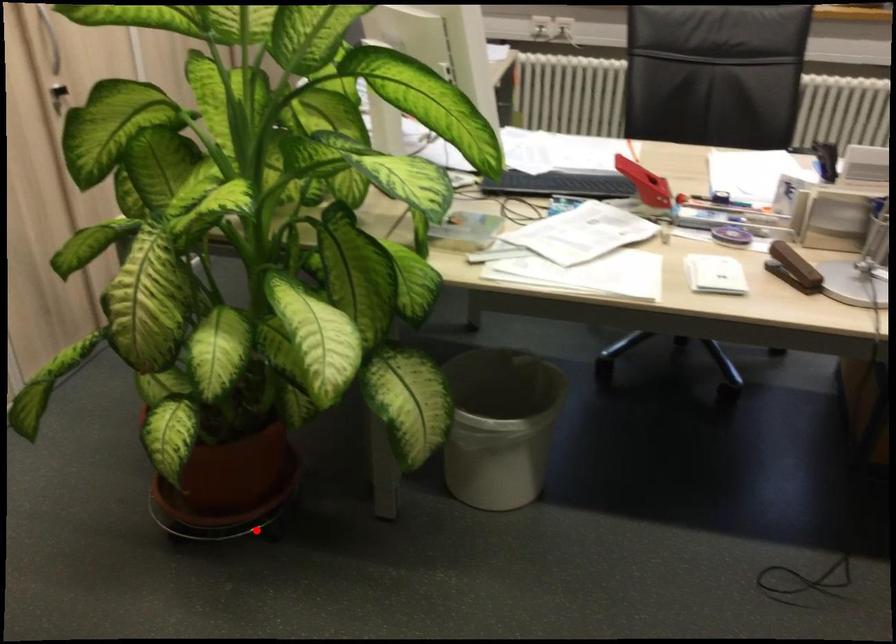
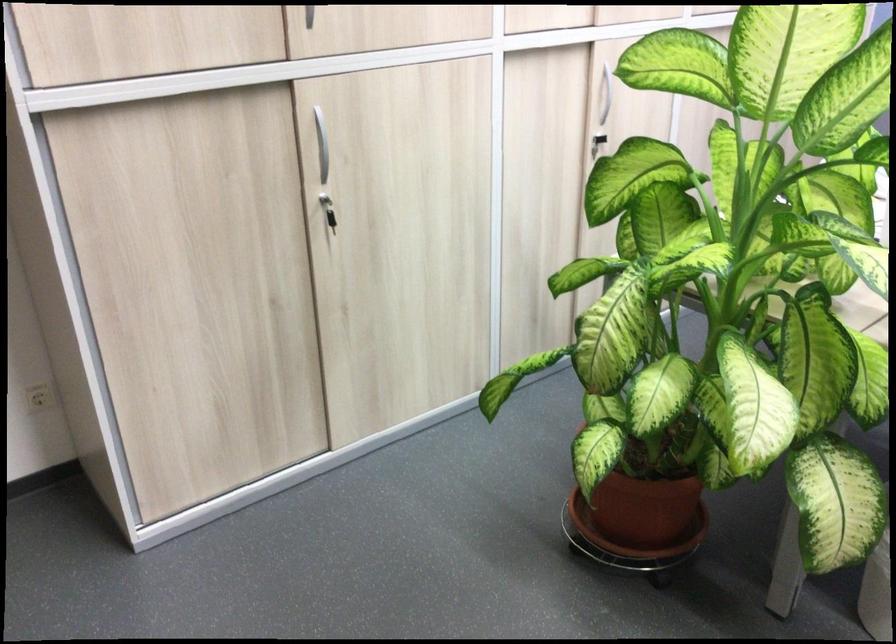
Question: I am providing you with two images of the same scene from different viewpoints. A red point is marked on the first image. Is the red point's position out of view in image 2?

Choices:
 (A) Yes
 (B) No

Answer: (B)